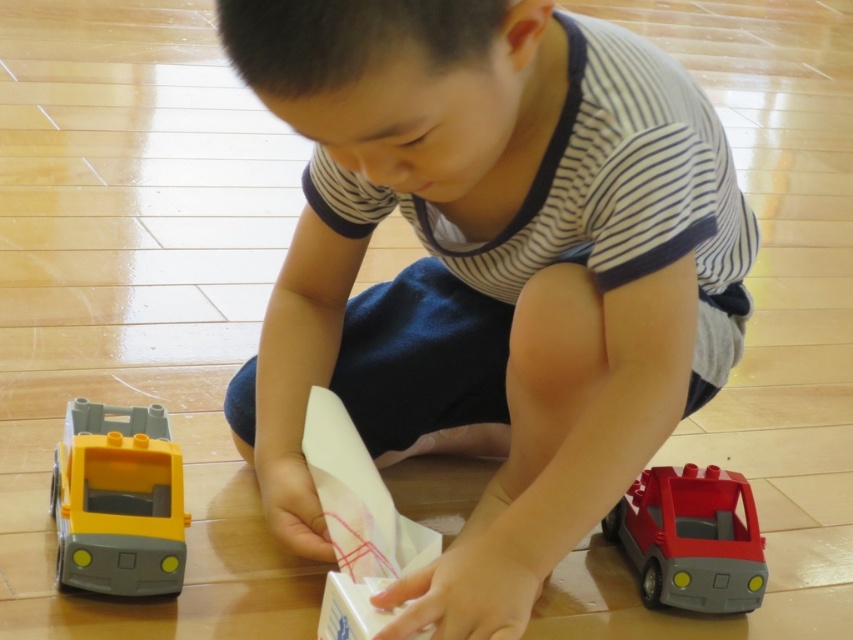
Is matte plastic boy at center above yellow plastic truck at lower left?

Yes, matte plastic boy at center is above yellow plastic truck at lower left.

Is matte plastic boy at center closer to camera compared to yellow plastic truck at lower left?

That is True.

Where is `matte plastic boy at center`? matte plastic boy at center is located at coordinates (489, 269).

Which is behind, point (117, 413) or point (724, 497)?

Point (724, 497)

In the scene shown: How distant is yellow plastic truck at lower left from matte red plastic toy car at lower right?

yellow plastic truck at lower left is 99.54 centimeters away from matte red plastic toy car at lower right.

The image size is (853, 640). I want to click on yellow plastic truck at lower left, so click(x=119, y=500).

At what (x,y) coordinates should I click in order to perform the action: click on yellow plastic truck at lower left. Please return your answer as a coordinate pair (x, y). Image resolution: width=853 pixels, height=640 pixels. Looking at the image, I should click on (119, 500).

Does matte plastic boy at center come behind matte red plastic toy car at lower right?

No, matte plastic boy at center is closer to the viewer.

Is matte plastic boy at center shorter than matte red plastic toy car at lower right?

No, matte plastic boy at center is not shorter than matte red plastic toy car at lower right.

Find the location of a particular element. Image resolution: width=853 pixels, height=640 pixels. matte plastic boy at center is located at coordinates tap(489, 269).

You are a GUI agent. You are given a task and a screenshot of the screen. Output one action in this format:
    pyautogui.click(x=<x>, y=<y>)
    Task: Click on the matte plastic boy at center
    The width and height of the screenshot is (853, 640).
    Given the screenshot: What is the action you would take?
    pyautogui.click(x=489, y=269)